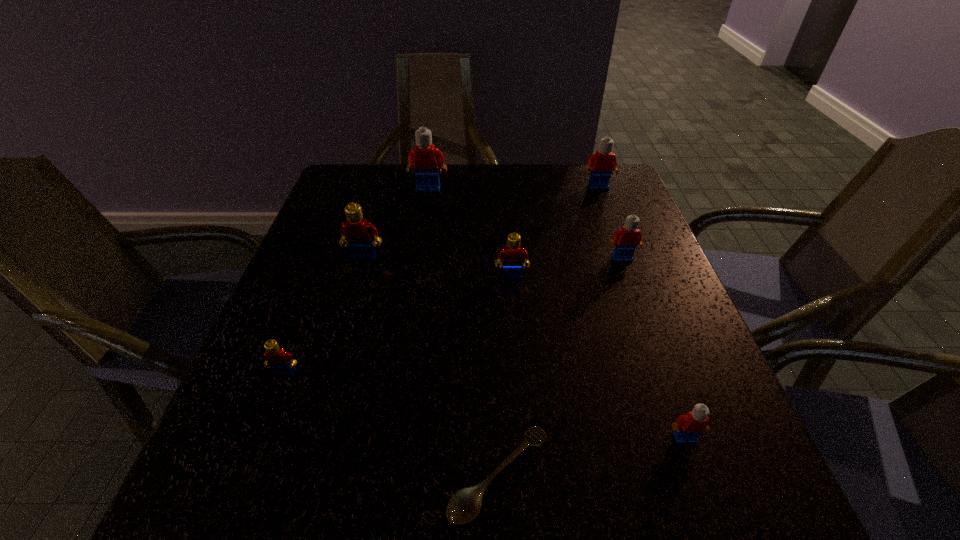
Locate an element on the screen. This screenshot has width=960, height=540. the smallest white Lego is located at coordinates (687, 428).

This screenshot has height=540, width=960. Identify the location of the nearest white Lego. (687, 428).

Identify the location of ladle. Image resolution: width=960 pixels, height=540 pixels. (465, 504).

Locate an element on the screen. Image resolution: width=960 pixels, height=540 pixels. vacant point located on the face of the biggest white Lego is located at coordinates (420, 237).

This screenshot has width=960, height=540. Identify the location of free space located 0.360m on the front-facing side of the second Lego from left to right. (322, 401).

The image size is (960, 540). What are the coordinates of `vacant region located 0.110m on the face of the second biggest white Lego` in the screenshot? It's located at (608, 213).

Find the location of a particular element. vacant point located 0.380m on the face of the second smallest white Lego is located at coordinates (678, 411).

I want to click on vacant space situated on the front-facing side of the second smallest red Lego, so tap(519, 377).

The width and height of the screenshot is (960, 540). Identify the location of free region located on the front-facing side of the smallest red Lego. (261, 436).

I want to click on vacant space located 0.080m on the face of the nearest white Lego, so click(x=706, y=497).